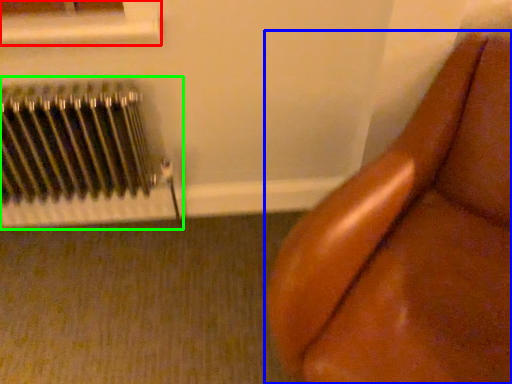
Question: Considering the real-world distances, which object is closest to window frame (highlighted by a red box)? furniture (highlighted by a blue box) or radiator (highlighted by a green box).

Choices:
 (A) furniture
 (B) radiator

Answer: (B)